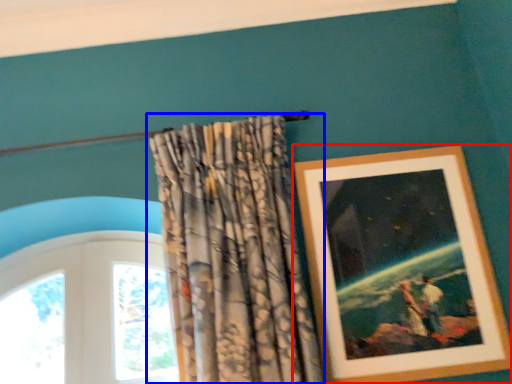
Question: Which of the following is the closest to the observer, picture frame (highlighted by a red box) or curtain (highlighted by a blue box)?

Choices:
 (A) picture frame
 (B) curtain

Answer: (B)